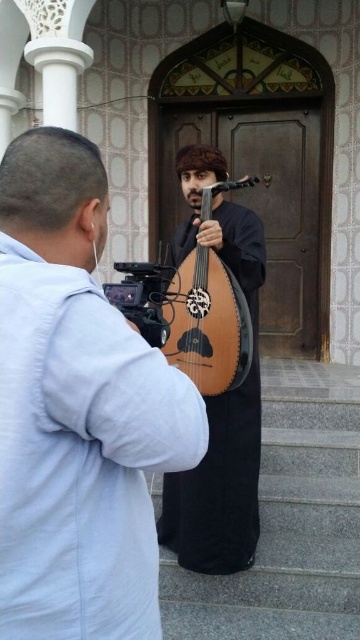
Question: Does matte black instrument at center appear on the right side of wooden at center?

Choices:
 (A) yes
 (B) no

Answer: (B)

Question: Among these objects, which one is nearest to the camera?

Choices:
 (A) wooden lute at center
 (B) wooden at center
 (C) matte black instrument at center

Answer: (C)

Question: Which point appears farthest from the camera in this image?

Choices:
 (A) (160, 637)
 (B) (240, 246)

Answer: (B)

Question: Considering the relative positions of wooden lute at center and wooden at center in the image provided, where is wooden lute at center located with respect to wooden at center?

Choices:
 (A) right
 (B) left

Answer: (A)

Question: Which point is closer to the camera taking this photo?

Choices:
 (A) (199, 348)
 (B) (209, 410)

Answer: (A)

Question: Is matte black instrument at center wider than wooden at center?

Choices:
 (A) yes
 (B) no

Answer: (B)